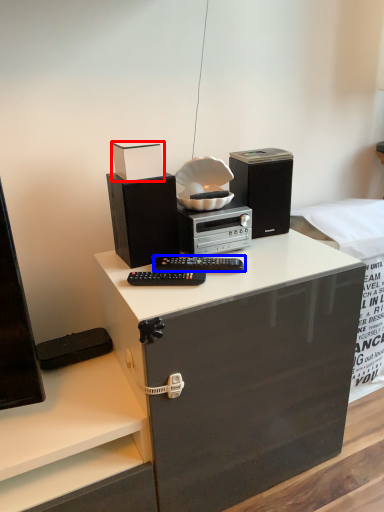
Question: Which point is further to the camera, box (highlighted by a red box) or audio (highlighted by a blue box)?

Choices:
 (A) box
 (B) audio

Answer: (B)